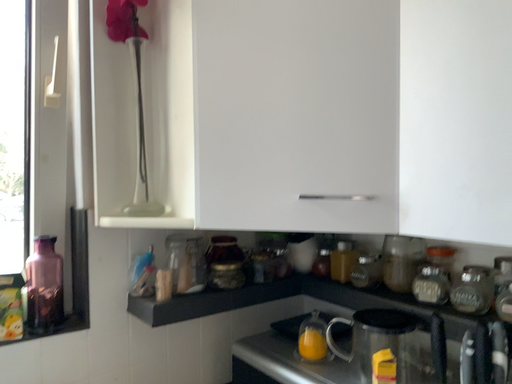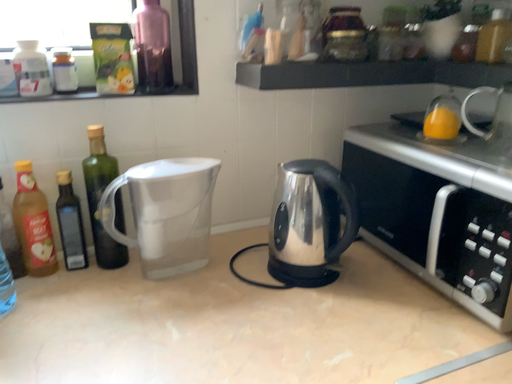
Question: How did the camera likely rotate when shooting the video?

Choices:
 (A) rotated left
 (B) rotated right

Answer: (A)